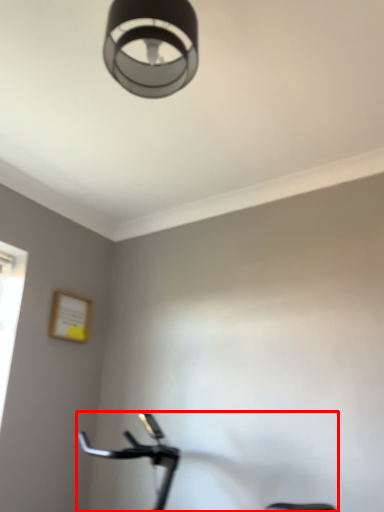
Question: Considering the relative positions of stationary bicycle (annotated by the red box) and lamp in the image provided, where is stationary bicycle (annotated by the red box) located with respect to the staircase?

Choices:
 (A) right
 (B) left

Answer: (A)